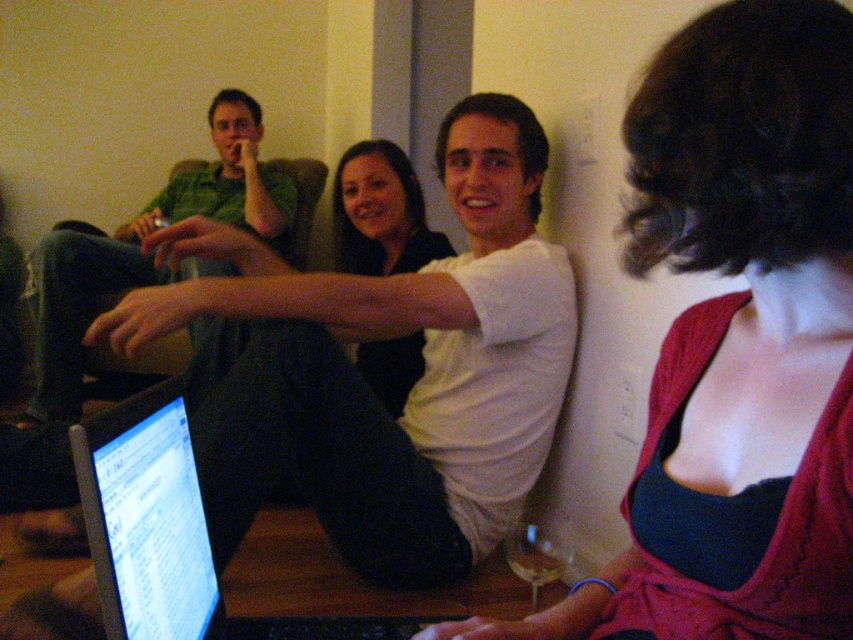
Question: Which of the following is the farthest from the observer?

Choices:
 (A) (126, 573)
 (B) (810, 312)
 (C) (27, 461)
 (D) (318, 467)

Answer: (C)

Question: Is matte red dress at center positioned at the back of green cotton shirt at left?

Choices:
 (A) yes
 (B) no

Answer: (B)

Question: Is white matte laptop at center further to the viewer compared to matte black shirt at center?

Choices:
 (A) no
 (B) yes

Answer: (A)

Question: Is matte red dress at center in front of matte black shirt at center?

Choices:
 (A) yes
 (B) no

Answer: (A)

Question: Which of these objects is positioned closest to the green cotton shirt at left?

Choices:
 (A) matte red dress at center
 (B) matte black shirt at center
 (C) silver glossy laptop at center
 (D) white matte laptop at center

Answer: (B)

Question: Which of the following is the closest to the observer?

Choices:
 (A) green cotton shirt at left
 (B) white matte laptop at center
 (C) matte red dress at center

Answer: (C)